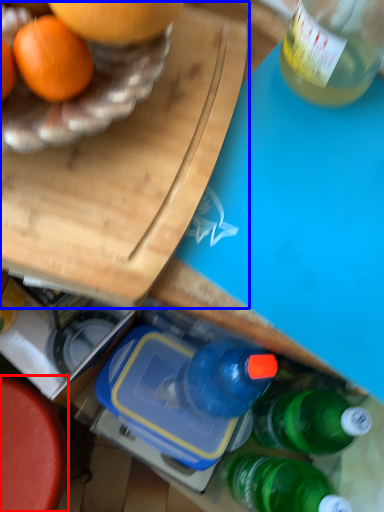
Question: Which object is closer to the camera taking this photo, round table (highlighted by a red box) or cutting board (highlighted by a blue box)?

Choices:
 (A) round table
 (B) cutting board

Answer: (B)